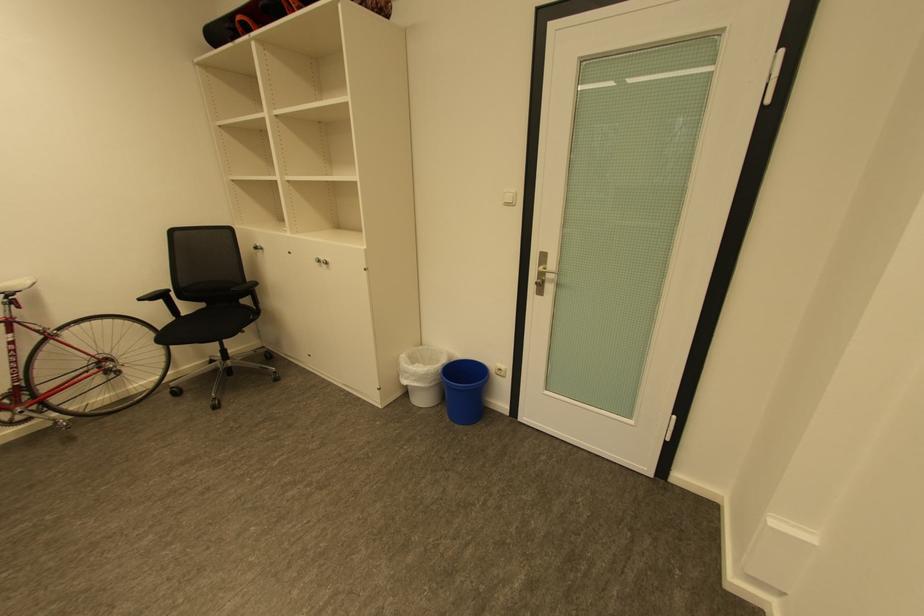
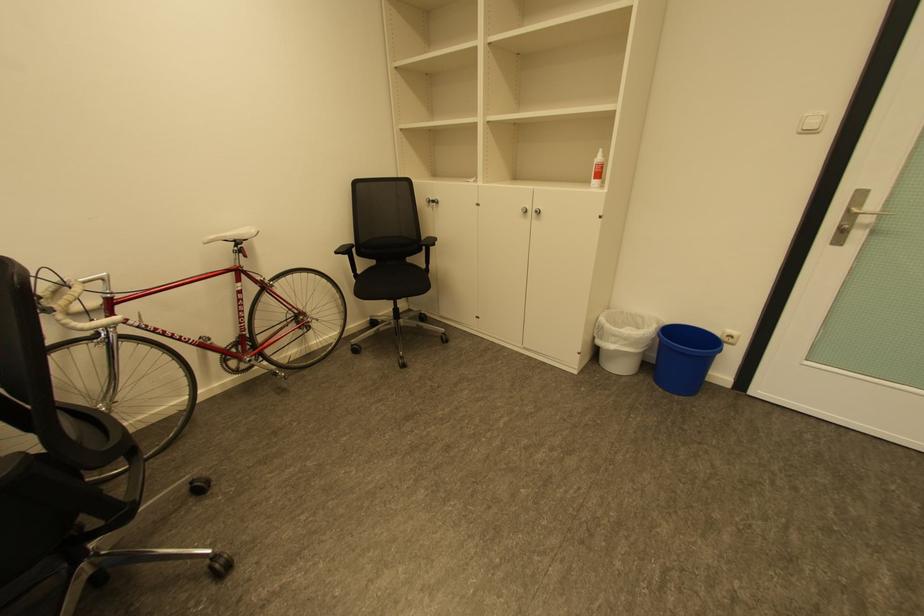
Where in the second image is the point corresponding to point 148,300 from the first image?

(344, 253)